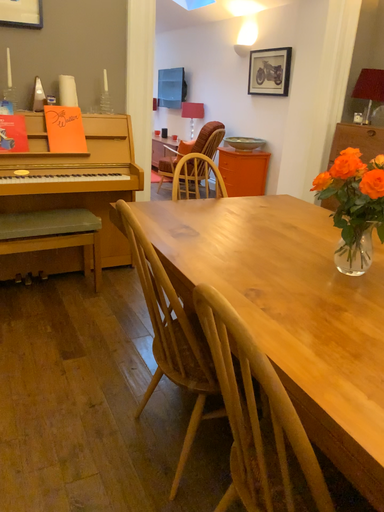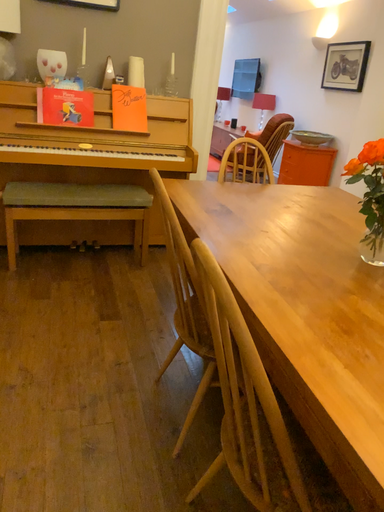
Question: How did the camera likely rotate when shooting the video?

Choices:
 (A) rotated left
 (B) rotated right

Answer: (A)